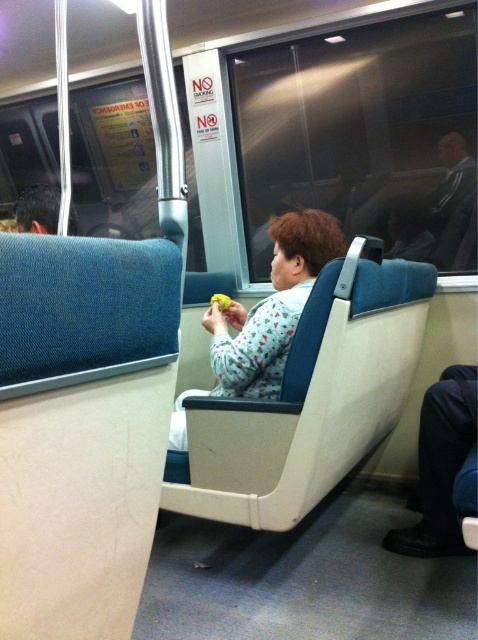
Question: Among these points, which one is farthest from the camera?

Choices:
 (A) (282, 310)
 (B) (55, 232)

Answer: (B)

Question: Can you confirm if floral-patterned fabric at center is thinner than dark gray suit at upper right?

Choices:
 (A) yes
 (B) no

Answer: (B)

Question: Which object is closer to the camera taking this photo?

Choices:
 (A) black leather shoe at lower right
 (B) floral-patterned fabric at center

Answer: (A)

Question: Can you confirm if dark gray suit at upper right is thinner than dark brown hair at upper left?

Choices:
 (A) yes
 (B) no

Answer: (A)

Question: From the image, what is the correct spatial relationship of floral-patterned fabric at center in relation to black leather shoe at lower right?

Choices:
 (A) left
 (B) right

Answer: (A)

Question: Which object is positioned closest to the dark gray suit at upper right?

Choices:
 (A) black leather shoe at lower right
 (B) floral-patterned fabric at center

Answer: (B)